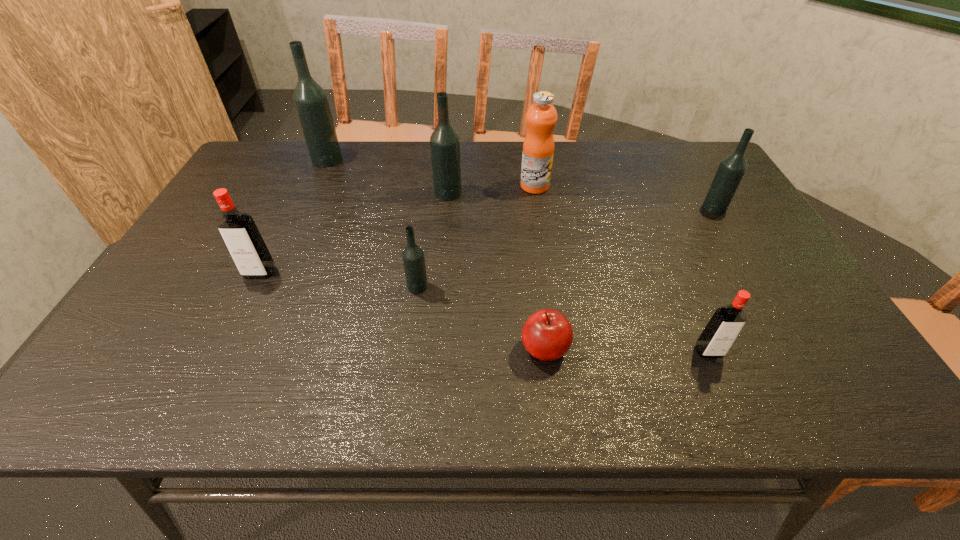
Image resolution: width=960 pixels, height=540 pixels. I want to click on the nearest vodka, so click(721, 331).

This screenshot has width=960, height=540. What are the coordinates of `the shortest object` in the screenshot? It's located at (x=547, y=335).

Image resolution: width=960 pixels, height=540 pixels. Identify the location of apple. (547, 335).

This screenshot has height=540, width=960. In order to click on vacant point located on the front of the biggest black vodka in this screenshot , I will do `click(289, 245)`.

Where is `free space located on the back of the second tallest vodka`? The width and height of the screenshot is (960, 540). free space located on the back of the second tallest vodka is located at coordinates (450, 162).

The width and height of the screenshot is (960, 540). Identify the location of free space located 0.350m on the front of the fruit juice. (549, 280).

The height and width of the screenshot is (540, 960). Find the location of `free space located 0.120m on the front of the third biggest black vodka`. free space located 0.120m on the front of the third biggest black vodka is located at coordinates (735, 243).

The image size is (960, 540). Find the location of `free space located 0.310m on the front and back of the farther red vodka`. free space located 0.310m on the front and back of the farther red vodka is located at coordinates click(x=200, y=397).

This screenshot has width=960, height=540. Identify the location of vacant area situated 0.310m on the right of the smallest black vodka. (558, 287).

I want to click on vacant region located on the front and back of the fifth vodka from left to right, so click(733, 409).